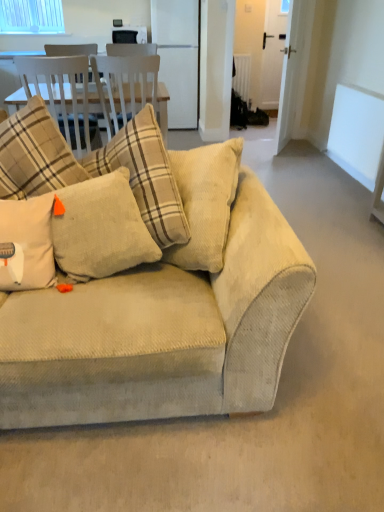
I want to click on clear glass window at upper left, so click(31, 17).

Describe the element at coordinates (178, 57) in the screenshot. I see `white glossy refrigerator at center` at that location.

Where is `beige corduroy pillow at center, the first pillow positioned from the left`? This screenshot has width=384, height=512. beige corduroy pillow at center, the first pillow positioned from the left is located at coordinates (35, 154).

Find the location of a particular element. clear glass window at upper left is located at coordinates (31, 17).

Which is more to the left, beige corduroy pillow at center, which is the 1th pillow in right-to-left order, or beige corduroy couch at center?

beige corduroy pillow at center, which is the 1th pillow in right-to-left order.

Does beige corduroy pillow at center, the second pillow viewed from the left, have a greater height compared to beige corduroy couch at center?

No, beige corduroy pillow at center, the second pillow viewed from the left, is not taller than beige corduroy couch at center.

Considering the relative sizes of beige corduroy pillow at center, which is the 1th pillow in right-to-left order, and beige corduroy couch at center in the image provided, is beige corduroy pillow at center, which is the 1th pillow in right-to-left order, wider than beige corduroy couch at center?

In fact, beige corduroy pillow at center, which is the 1th pillow in right-to-left order, might be narrower than beige corduroy couch at center.

Is beige corduroy pillow at center, the second pillow viewed from the left, spatially inside beige corduroy couch at center, or outside of it?

beige corduroy pillow at center, the second pillow viewed from the left, is located beyond the bounds of beige corduroy couch at center.

From the image's perspective, which is above, beige corduroy pillow at center, which is counted as the second pillow, starting from the right, or beige corduroy pillow at center, which is the 1th pillow in right-to-left order?

beige corduroy pillow at center, which is counted as the second pillow, starting from the right.

Is beige corduroy pillow at center, which is counted as the second pillow, starting from the right, to the right of beige corduroy pillow at center, the second pillow viewed from the left, from the viewer's perspective?

No, beige corduroy pillow at center, which is counted as the second pillow, starting from the right, is not to the right of beige corduroy pillow at center, the second pillow viewed from the left.

Find the location of a particular element. Image resolution: width=384 pixels, height=512 pixels. pillow above the beige corduroy pillow at center, which is the 1th pillow in right-to-left order (from a real-world perspective) is located at coordinates coord(35,154).

How different are the orientations of beige corduroy pillow at center, the first pillow positioned from the left, and beige corduroy pillow at center, the second pillow viewed from the left, in degrees?

They differ by 4.85 degrees in their facing directions.

Does point (369, 97) come behind point (9, 29)?

No, it is in front of (9, 29).

Is white matte window screen at upper right inside or outside of clear glass window at upper left?

white matte window screen at upper right lies outside clear glass window at upper left.

Locate an element on the screen. window screen that is in front of the clear glass window at upper left is located at coordinates (357, 133).

Is white glossy refrigerator at center wider or thinner than white matte window screen at upper right?

white glossy refrigerator at center is wider than white matte window screen at upper right.

Based on the photo, from a real-world perspective, is white glossy refrigerator at center located beneath white matte window screen at upper right?

No, from a real-world perspective, white glossy refrigerator at center is not below white matte window screen at upper right.

Is white glossy refrigerator at center facing towards white matte window screen at upper right?

No.

From the image's perspective, would you say white glossy refrigerator at center is positioned over white matte window screen at upper right?

Yes, from the image's perspective, white glossy refrigerator at center is above white matte window screen at upper right.

At what (x,y) coordinates should I click in order to perform the action: click on the 1st pillow behind when counting from the beige corduroy couch at center. Please return your answer as a coordinate pair (x, y). The height and width of the screenshot is (512, 384). Looking at the image, I should click on (101, 229).

Between beige corduroy couch at center and beige corduroy pillow at center, which is the 1th pillow in right-to-left order, which one appears on the right side from the viewer's perspective?

From the viewer's perspective, beige corduroy couch at center appears more on the right side.

Based on the photo, in terms of width, does beige corduroy couch at center look wider or thinner when compared to beige corduroy pillow at center, which is the 1th pillow in right-to-left order?

Considering their sizes, beige corduroy couch at center looks broader than beige corduroy pillow at center, which is the 1th pillow in right-to-left order.

From the image's perspective, is beige corduroy couch at center below beige corduroy pillow at center, which is the 1th pillow in right-to-left order?

No.

How distant is beige corduroy pillow at center, which is counted as the second pillow, starting from the right, from clear glass window at upper left?

beige corduroy pillow at center, which is counted as the second pillow, starting from the right, and clear glass window at upper left are 10.38 feet apart.

Are beige corduroy pillow at center, the first pillow positioned from the left, and clear glass window at upper left far apart?

Yes.

From the clear glass window at upper left, count 1st pillows forward and point to it. Please provide its 2D coordinates.

[(35, 154)]

Is beige corduroy pillow at center, the first pillow positioned from the left, not within clear glass window at upper left?

That's correct, beige corduroy pillow at center, the first pillow positioned from the left, is outside of clear glass window at upper left.

Looking at their sizes, would you say beige corduroy pillow at center, the second pillow viewed from the left, is wider or thinner than white matte window screen at upper right?

Considering their sizes, beige corduroy pillow at center, the second pillow viewed from the left, looks broader than white matte window screen at upper right.

In terms of size, does beige corduroy pillow at center, the second pillow viewed from the left, appear bigger or smaller than white matte window screen at upper right?

Considering their sizes, beige corduroy pillow at center, the second pillow viewed from the left, takes up less space than white matte window screen at upper right.

Which is nearer, (91, 178) or (362, 125)?

The point (91, 178) is closer to the camera.

In the image, there is a beige corduroy pillow at center, which is the 1th pillow in right-to-left order. Where is `studio couch below it (from a real-world perspective)`? The height and width of the screenshot is (512, 384). studio couch below it (from a real-world perspective) is located at coordinates (144, 296).

The image size is (384, 512). Find the location of `pillow that appears on the left of beige corduroy pillow at center, which is the 1th pillow in right-to-left order`. pillow that appears on the left of beige corduroy pillow at center, which is the 1th pillow in right-to-left order is located at coordinates (35, 154).

Looking at the image, which one is located closer to beige corduroy pillow at center, the second pillow viewed from the left, beige corduroy couch at center or white glossy refrigerator at center?

beige corduroy couch at center lies closer to beige corduroy pillow at center, the second pillow viewed from the left, than the other object.

Looking at the image, which one is located closer to white matte window screen at upper right, beige corduroy couch at center or clear glass window at upper left?

The object closer to white matte window screen at upper right is beige corduroy couch at center.

Considering their positions, is beige corduroy pillow at center, the first pillow positioned from the left, positioned closer to clear glass window at upper left than beige corduroy pillow at center, the second pillow viewed from the left?

beige corduroy pillow at center, the first pillow positioned from the left, lies closer to clear glass window at upper left than the other object.

Estimate the real-world distances between objects in this image. Which object is closer to beige corduroy pillow at center, the first pillow positioned from the left, beige corduroy pillow at center, the second pillow viewed from the left, or beige corduroy couch at center?

Among the two, beige corduroy pillow at center, the second pillow viewed from the left, is located nearer to beige corduroy pillow at center, the first pillow positioned from the left.

Estimate the real-world distances between objects in this image. Which object is further from beige corduroy pillow at center, which is counted as the second pillow, starting from the right, clear glass window at upper left or white glossy refrigerator at center?

Among the two, white glossy refrigerator at center is located further to beige corduroy pillow at center, which is counted as the second pillow, starting from the right.

Looking at the image, which one is located further to beige corduroy pillow at center, which is the 1th pillow in right-to-left order, clear glass window at upper left or white matte window screen at upper right?

clear glass window at upper left.

When comparing their distances from white glossy refrigerator at center, does beige corduroy pillow at center, which is counted as the second pillow, starting from the right, or beige corduroy pillow at center, which is the 1th pillow in right-to-left order, seem further?

Based on the image, beige corduroy pillow at center, which is the 1th pillow in right-to-left order, appears to be further to white glossy refrigerator at center.

When comparing their distances from white glossy refrigerator at center, does clear glass window at upper left or beige corduroy pillow at center, the first pillow positioned from the left, seem closer?

clear glass window at upper left.

Where is `studio couch located between beige corduroy pillow at center, which is counted as the second pillow, starting from the right, and white matte window screen at upper right in the left-right direction`? The image size is (384, 512). studio couch located between beige corduroy pillow at center, which is counted as the second pillow, starting from the right, and white matte window screen at upper right in the left-right direction is located at coordinates (144, 296).

Image resolution: width=384 pixels, height=512 pixels. Find the location of `pillow between beige corduroy pillow at center, which is counted as the second pillow, starting from the right, and beige corduroy couch at center from left to right`. pillow between beige corduroy pillow at center, which is counted as the second pillow, starting from the right, and beige corduroy couch at center from left to right is located at coordinates (101, 229).

Where is `appliance located between clear glass window at upper left and white matte window screen at upper right in the left-right direction`? appliance located between clear glass window at upper left and white matte window screen at upper right in the left-right direction is located at coordinates (178, 57).

The width and height of the screenshot is (384, 512). Identify the location of window screen between beige corduroy pillow at center, which is the 1th pillow in right-to-left order, and white glossy refrigerator at center in the front-back direction. (357, 133).